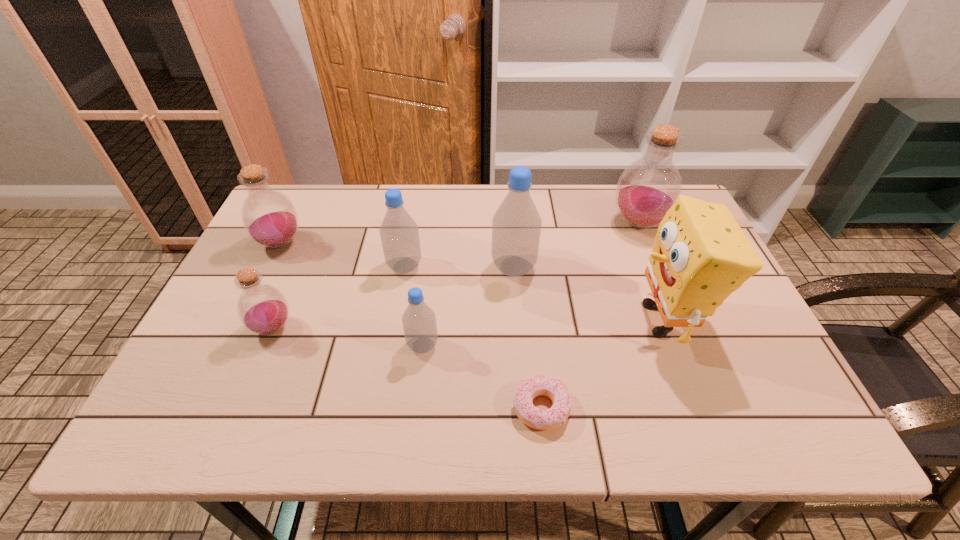
Where is `empty location between the smallest purple bottle and the doughnut`? This screenshot has width=960, height=540. empty location between the smallest purple bottle and the doughnut is located at coordinates (407, 368).

Find the location of a particular element. Image resolution: width=960 pixels, height=540 pixels. unoccupied area between the shortest object and the rightmost gray bottle is located at coordinates (528, 338).

Find the location of a particular element. The width and height of the screenshot is (960, 540). vacant point located between the nearest gray bottle and the white doughnut is located at coordinates pyautogui.click(x=482, y=377).

What are the coordinates of `free space between the sponge and the nearest purple bottle` in the screenshot? It's located at (468, 324).

This screenshot has width=960, height=540. I want to click on empty space that is in between the nearest gray bottle and the white doughnut, so click(x=482, y=377).

Find the location of a particular element. The width and height of the screenshot is (960, 540). unoccupied position between the doughnut and the rightmost gray bottle is located at coordinates (528, 338).

Identify the location of object identified as the third closest to the nearest purple bottle. The height and width of the screenshot is (540, 960). (419, 323).

Where is `the sixth closest object to the nearest gray bottle`? The image size is (960, 540). the sixth closest object to the nearest gray bottle is located at coordinates (700, 255).

The image size is (960, 540). I want to click on bottle that is the sixth closest to the yellow sponge, so click(x=269, y=217).

The height and width of the screenshot is (540, 960). Identify the location of the fourth closest bottle to the sponge. (399, 233).